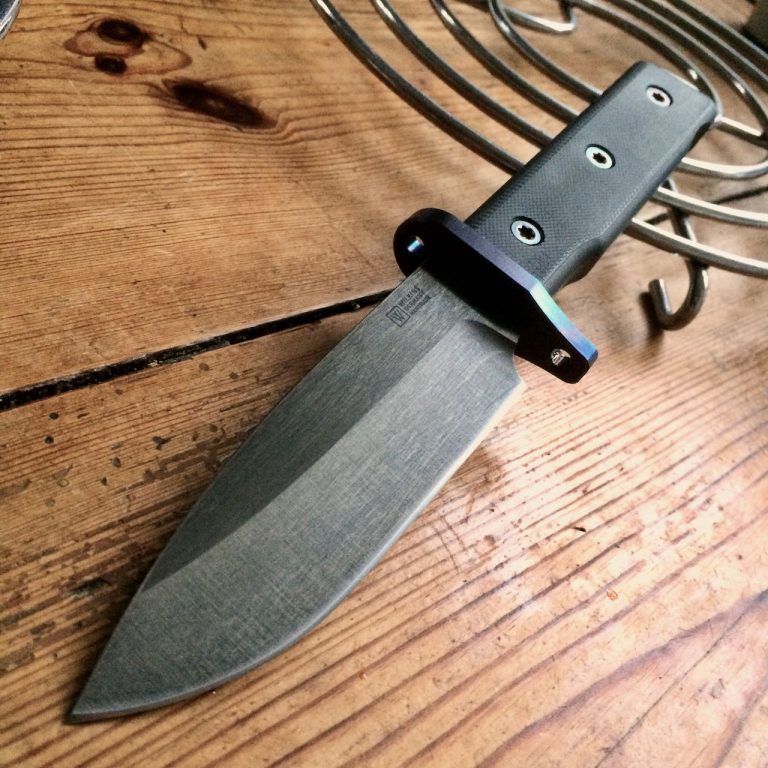
Image resolution: width=768 pixels, height=768 pixels. Identify the location of black stove grill. (474, 147), (508, 123).